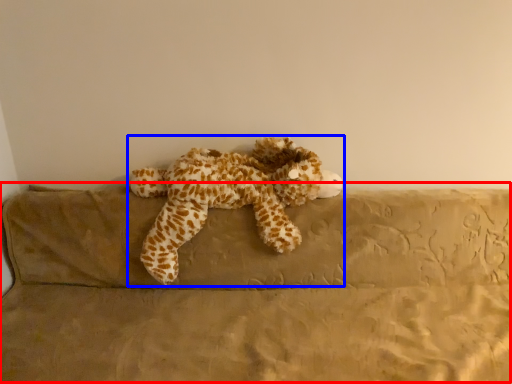
Question: Which of the following is the closest to the observer, couch (highlighted by a red box) or toy (highlighted by a blue box)?

Choices:
 (A) couch
 (B) toy

Answer: (A)